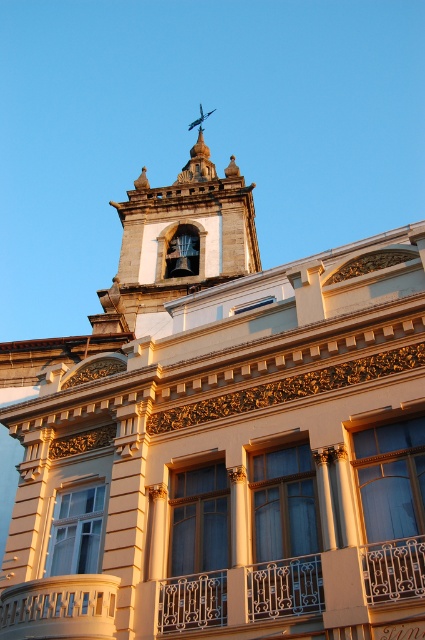
How much distance is there between gold wrought iron balcony at center and dark gray stone bell tower at upper center?

gold wrought iron balcony at center and dark gray stone bell tower at upper center are 185.96 feet apart from each other.

Is gold wrought iron balcony at center wider than dark gray stone bell tower at upper center?

No, gold wrought iron balcony at center is not wider than dark gray stone bell tower at upper center.

Find the location of a particular element. gold wrought iron balcony at center is located at coordinates (292, 595).

The image size is (425, 640). What are the coordinates of `gold wrought iron balcony at center` in the screenshot? It's located at (292, 595).